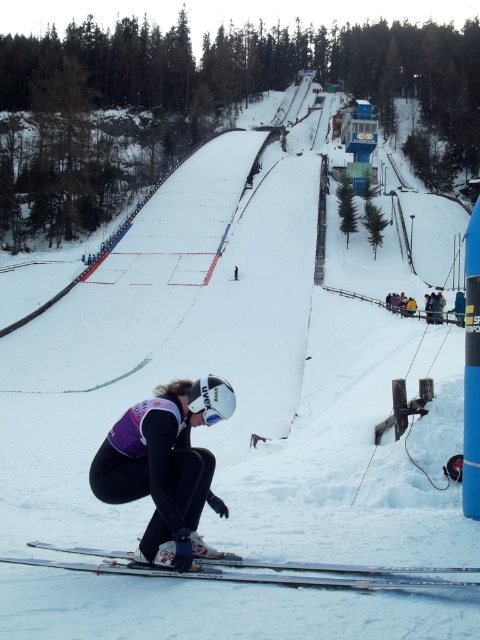
Question: Which object is closer to the camera taking this photo?

Choices:
 (A) yellow fabric jacket at right
 (B) white glossy skis at lower center
 (C) matte purple ski suit at lower center

Answer: (B)

Question: Among these points, which one is nearest to the camera?

Choices:
 (A) (439, 305)
 (B) (204, 452)

Answer: (B)

Question: Which point is farther to the camera?

Choices:
 (A) (394, 298)
 (B) (113, 568)
 (C) (189, 512)

Answer: (A)

Question: Does matte purple ski suit at lower center appear under white glossy skis at lower center?

Choices:
 (A) no
 (B) yes

Answer: (A)

Question: Considering the relative positions of matte purple ski suit at lower center and yellow fabric jacket at right in the image provided, where is matte purple ski suit at lower center located with respect to yellow fabric jacket at right?

Choices:
 (A) above
 (B) below

Answer: (B)

Question: In this image, where is matte purple ski suit at lower center located relative to white glossy skis at lower center?

Choices:
 (A) left
 (B) right

Answer: (A)